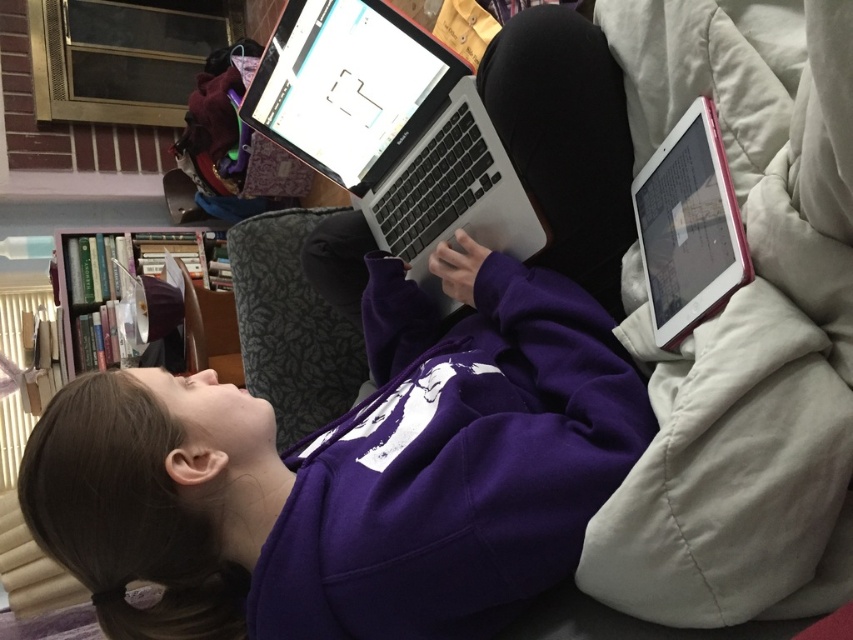
Between wooden bookshelf at left and pink plastic tablet at upper right, which one has less height?

Standing shorter between the two is pink plastic tablet at upper right.

The height and width of the screenshot is (640, 853). What do you see at coordinates (146, 304) in the screenshot?
I see `wooden bookshelf at left` at bounding box center [146, 304].

Describe the element at coordinates (146, 304) in the screenshot. I see `wooden bookshelf at left` at that location.

I want to click on wooden bookshelf at left, so click(146, 304).

Who is positioned more to the right, purple fleece sweatshirt at center or pink plastic tablet at upper right?

Positioned to the right is pink plastic tablet at upper right.

Who is positioned more to the left, purple fleece sweatshirt at center or pink plastic tablet at upper right?

purple fleece sweatshirt at center is more to the left.

Between point (396, 326) and point (695, 282), which one is positioned in front?

Point (695, 282) is more forward.

Identify the location of purple fleece sweatshirt at center. The width and height of the screenshot is (853, 640). (383, 397).

Is silver metallic laptop at center positioned behind pink plastic tablet at upper right?

Yes, silver metallic laptop at center is behind pink plastic tablet at upper right.

What do you see at coordinates (390, 131) in the screenshot?
I see `silver metallic laptop at center` at bounding box center [390, 131].

This screenshot has height=640, width=853. What are the coordinates of `silver metallic laptop at center` in the screenshot? It's located at (390, 131).